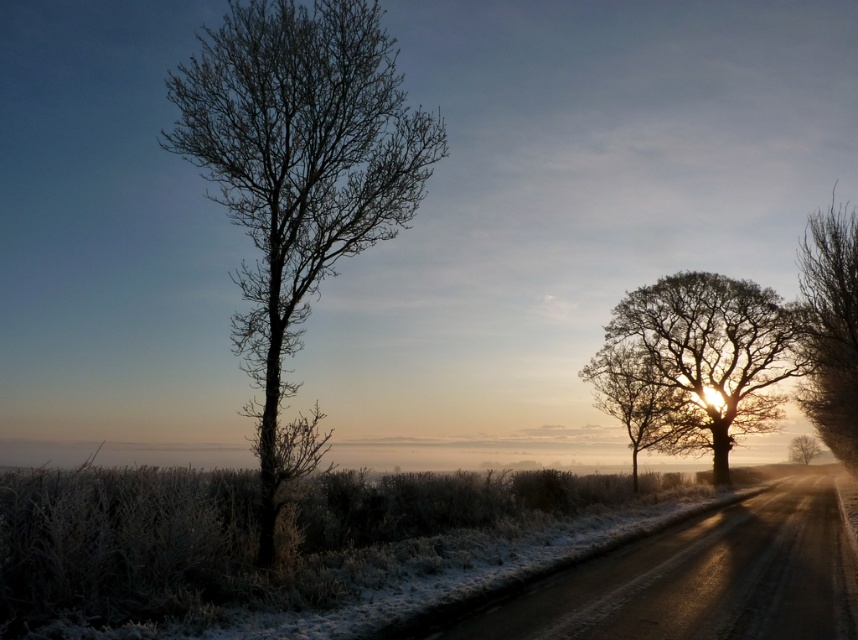
Is bare branches at left positioned at the back of smooth brown tree at right?

That is False.

Is bare branches at left closer to the viewer compared to smooth brown tree at right?

That is True.

Find the location of a particular element. bare branches at left is located at coordinates (298, 180).

The height and width of the screenshot is (640, 858). Identify the location of bare branches at left. (298, 180).

Consider the image. Can you confirm if silvery frosty tree at right is thinner than smooth brown tree at right?

No, silvery frosty tree at right is not thinner than smooth brown tree at right.

Can you confirm if silvery frosty tree at right is bigger than smooth brown tree at right?

Yes, silvery frosty tree at right is bigger than smooth brown tree at right.

What are the coordinates of `silvery frosty tree at right` in the screenshot? It's located at 633,397.

Locate an element on the screen. The width and height of the screenshot is (858, 640). silvery frosty tree at right is located at coordinates (633, 397).

Is point (732, 304) positioned after point (849, 246)?

Yes, it is.

Between silhouetted bark tree at right and silvery bark tree at right, which one appears on the right side from the viewer's perspective?

Positioned to the right is silvery bark tree at right.

Is point (726, 458) closer to camera compared to point (847, 224)?

No, (726, 458) is further to viewer.

Where is `silhouetted bark tree at right`? silhouetted bark tree at right is located at coordinates (699, 362).